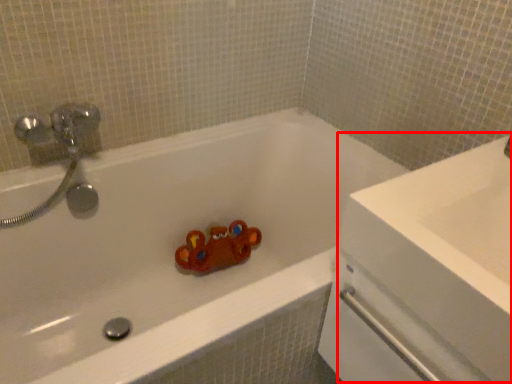
Question: From the image's perspective, what is the correct spatial positioning of counter top (annotated by the red box) in reference to bathtub?

Choices:
 (A) below
 (B) above

Answer: (B)